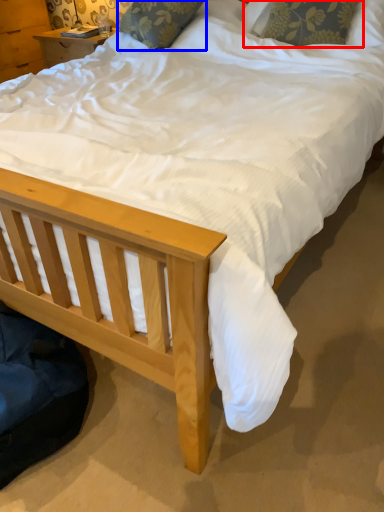
Question: Which of the following is the closest to the observer, pillow (highlighted by a red box) or pillow (highlighted by a blue box)?

Choices:
 (A) pillow
 (B) pillow

Answer: (A)